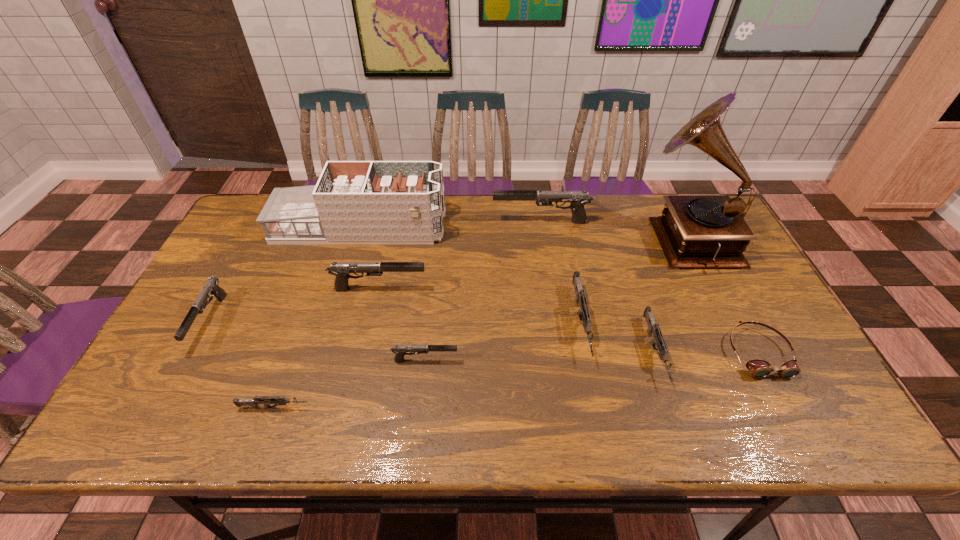
What are the coordinates of `dollhouse located in the far edge section of the desktop` in the screenshot? It's located at (362, 202).

Locate an element on the screen. This screenshot has height=540, width=960. gun that is at the far edge is located at coordinates (578, 199).

Where is `object that is positioned at the near edge`? The image size is (960, 540). object that is positioned at the near edge is located at coordinates coord(282,400).

Find the location of a particular element. The width and height of the screenshot is (960, 540). dollhouse that is at the left edge is located at coordinates (362, 202).

You are a GUI agent. You are given a task and a screenshot of the screen. Output one action in this format:
    pyautogui.click(x=<x>, y=<y>)
    Task: Click on the gun present at the left edge
    This screenshot has width=960, height=540.
    Given the screenshot: What is the action you would take?
    (211, 286)

Find the location of a particular element. record player that is at the right edge is located at coordinates (694, 231).

I want to click on goggles present at the right edge, so click(758, 368).

In order to click on object that is at the far left corner in this screenshot , I will do `click(362, 202)`.

Locate an element on the screen. The image size is (960, 540). object that is at the far right corner is located at coordinates (694, 231).

At what (x,y) coordinates should I click in order to perform the action: click on vacant space at the near edge. Please return your answer as a coordinate pair (x, y). Looking at the image, I should click on (335, 430).